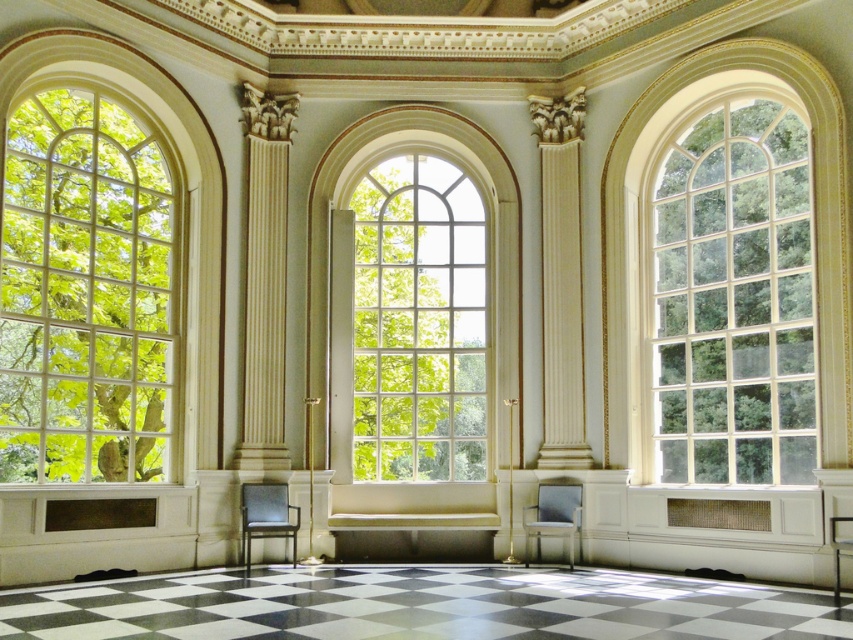
Between clear glass window at right and clear glass window at center, which one is positioned lower?

clear glass window at center is below.

Is clear glass window at right positioned in front of clear glass window at center?

Yes.

This screenshot has height=640, width=853. Find the location of `clear glass window at right`. clear glass window at right is located at coordinates (733, 300).

You are a GUI agent. You are given a task and a screenshot of the screen. Output one action in this format:
    pyautogui.click(x=<x>, y=<y>)
    Task: Click on the clear glass window at right
    The image size is (853, 640).
    Given the screenshot: What is the action you would take?
    point(733,300)

Does clear glass window at left appear on the right side of clear glass window at right?

Incorrect, clear glass window at left is not on the right side of clear glass window at right.

Can you confirm if clear glass window at left is positioned below clear glass window at right?

Yes.

Which is in front, point (170, 324) or point (784, 458)?

Point (784, 458) is more forward.

Identify the location of clear glass window at left. The image size is (853, 640). (84, 294).

Between point (76, 307) and point (363, 401), which one is positioned in front?

Point (76, 307)

Is point (73, 211) farther from camera compared to point (378, 285)?

No, it is in front of (378, 285).

Is point (149, 320) positioned before point (368, 288)?

Yes, point (149, 320) is in front of point (368, 288).

At what (x,y) coordinates should I click in order to perform the action: click on clear glass window at left. Please return your answer as a coordinate pair (x, y). The image size is (853, 640). Looking at the image, I should click on (84, 294).